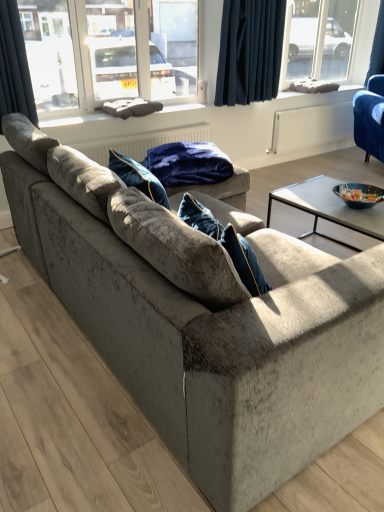
The image size is (384, 512). What do you see at coordinates (309, 86) in the screenshot? I see `blue fabric cushion at upper center, arranged as the 2th window sill when viewed from the left` at bounding box center [309, 86].

Locate an element on the screen. velvet blue armchair at upper right is located at coordinates (370, 118).

At what (x,y) coordinates should I click in order to perform the action: click on velvet blue blanket at center. Please return your answer as a coordinate pair (x, y). Looking at the image, I should click on (188, 164).

What do you see at coordinates (14, 66) in the screenshot? I see `dark blue velvet curtain at upper left, arranged as the 3th curtain when viewed from the back` at bounding box center [14, 66].

This screenshot has width=384, height=512. What do you see at coordinates (377, 47) in the screenshot?
I see `dark blue velvet curtain at upper right, marked as the third curtain in a left-to-right arrangement` at bounding box center [377, 47].

Find the location of `gray fabric cushion at center, which is the second window sill from top to bottom`. gray fabric cushion at center, which is the second window sill from top to bottom is located at coordinates (70, 120).

You are a GUI agent. You are given a task and a screenshot of the screen. Output one action in this format:
    pyautogui.click(x=<x>, y=<y>)
    Task: Click on the clear glass window frame at upper center
    This screenshot has width=384, height=512.
    Given the screenshot: What is the action you would take?
    pyautogui.click(x=81, y=51)

Does gray fabric cushion at center, arranged as the first window sill when ordered from the bottom, come in front of dark blue velvet curtain at upper right, marked as the third curtain in a left-to-right arrangement?

Yes, it is.

Is gray fabric cushion at center, the first window sill from the left, facing away from dark blue velvet curtain at upper right, which ranks as the first curtain in right-to-left order?

That's not correct — gray fabric cushion at center, the first window sill from the left, is not looking away from dark blue velvet curtain at upper right, which ranks as the first curtain in right-to-left order.

Looking at this image, from the image's perspective, which one is positioned lower, gray fabric cushion at center, positioned as the 2th window sill in right-to-left order, or dark blue velvet curtain at upper right, acting as the 3th curtain starting from the front?

gray fabric cushion at center, positioned as the 2th window sill in right-to-left order, is shown below in the image.

Does gray fabric cushion at center, marked as the 1th window sill in a front-to-back arrangement, have a lesser height compared to blue fabric cushion at upper center, arranged as the 2th window sill when viewed from the left?

Yes, gray fabric cushion at center, marked as the 1th window sill in a front-to-back arrangement, is shorter than blue fabric cushion at upper center, arranged as the 2th window sill when viewed from the left.

Is point (182, 104) behind point (299, 90)?

No, it is in front of (299, 90).

From a real-world perspective, which is physically below, gray fabric cushion at center, the 2th window sill viewed from the back, or blue fabric cushion at upper center, arranged as the 2th window sill when viewed from the left?

From a 3D spatial view, blue fabric cushion at upper center, arranged as the 2th window sill when viewed from the left, is below.

Would you say dark blue fabric at upper center, which appears as the second curtain when viewed from the back, is a long distance from gray fabric cushion at center, positioned as the 2th window sill in right-to-left order?

Yes, dark blue fabric at upper center, which appears as the second curtain when viewed from the back, and gray fabric cushion at center, positioned as the 2th window sill in right-to-left order, are quite far apart.

Considering the positions of objects dark blue fabric at upper center, acting as the 2th curtain starting from the right, and gray fabric cushion at center, the first window sill from the left, in the image provided, who is in front, dark blue fabric at upper center, acting as the 2th curtain starting from the right, or gray fabric cushion at center, the first window sill from the left,?

gray fabric cushion at center, the first window sill from the left.

Is dark blue fabric at upper center, acting as the 2th curtain starting from the right, positioned with its back to gray fabric cushion at center, positioned as the 2th window sill in right-to-left order?

dark blue fabric at upper center, acting as the 2th curtain starting from the right, is not turned away from gray fabric cushion at center, positioned as the 2th window sill in right-to-left order.

From the image's perspective, is velvet blue blanket at center below gray fabric cushion at center, the first window sill from the left?

Indeed, from the image's perspective, velvet blue blanket at center is shown beneath gray fabric cushion at center, the first window sill from the left.

Locate an element on the screen. The width and height of the screenshot is (384, 512). material to the right of gray fabric cushion at center, positioned as the 2th window sill in right-to-left order is located at coordinates (188, 164).

Are velvet blue blanket at center and gray fabric cushion at center, arranged as the first window sill when ordered from the bottom, making contact?

No, velvet blue blanket at center is not next to gray fabric cushion at center, arranged as the first window sill when ordered from the bottom.

Is velvet blue blanket at center aimed at gray fabric cushion at center, marked as the 1th window sill in a front-to-back arrangement?

No.

At what (x,y) coordinates should I click in order to perform the action: click on material in front of the clear glass window frame at upper center. Please return your answer as a coordinate pair (x, y). The height and width of the screenshot is (512, 384). Looking at the image, I should click on (188, 164).

Is clear glass window frame at upper center at the back of velvet blue blanket at center?

No, velvet blue blanket at center's orientation is not away from clear glass window frame at upper center.

Is velvet blue blanket at center taller or shorter than clear glass window frame at upper center?

In the image, velvet blue blanket at center appears to be shorter than clear glass window frame at upper center.

Is point (151, 164) less distant than point (65, 78)?

Yes, point (151, 164) is closer to viewer.

This screenshot has height=512, width=384. What are the coordinates of `curtain behind the blue fabric cushion at upper center, which is the first window sill from top to bottom` in the screenshot? It's located at (377, 47).

Is blue fabric cushion at upper center, which is the first window sill from top to bottom, closer to the viewer compared to dark blue velvet curtain at upper right, marked as the third curtain in a left-to-right arrangement?

Yes, blue fabric cushion at upper center, which is the first window sill from top to bottom, is in front of dark blue velvet curtain at upper right, marked as the third curtain in a left-to-right arrangement.

Is blue fabric cushion at upper center, the first window sill in the right-to-left sequence, outside of dark blue velvet curtain at upper right, marked as the third curtain in a left-to-right arrangement?

Yes, blue fabric cushion at upper center, the first window sill in the right-to-left sequence, is not within dark blue velvet curtain at upper right, marked as the third curtain in a left-to-right arrangement.

Does blue fabric cushion at upper center, which is the first window sill from top to bottom, have a lesser width compared to dark blue velvet curtain at upper right, marked as the third curtain in a left-to-right arrangement?

No.

How many degrees apart are the facing directions of gray fabric cushion at center, positioned as the 2th window sill in right-to-left order, and clear glass window frame at upper center?

0.0103 degrees.

Does gray fabric cushion at center, marked as the 1th window sill in a front-to-back arrangement, turn towards clear glass window frame at upper center?

No, gray fabric cushion at center, marked as the 1th window sill in a front-to-back arrangement, is not aimed at clear glass window frame at upper center.

Is gray fabric cushion at center, marked as the 1th window sill in a front-to-back arrangement, touching clear glass window frame at upper center?

No, gray fabric cushion at center, marked as the 1th window sill in a front-to-back arrangement, is not beside clear glass window frame at upper center.

Which window sill is the 1st one when counting from the back of the clear glass window frame at upper center? Please provide its 2D coordinates.

[(70, 120)]

In order to click on the 3rd curtain directly above the gray fabric cushion at center, the 2th window sill viewed from the back (from a real-world perspective) in this screenshot , I will do (377, 47).

Where is `window sill that is in front of the blue fabric cushion at upper center, which is the first window sill from top to bottom`? window sill that is in front of the blue fabric cushion at upper center, which is the first window sill from top to bottom is located at coordinates (70, 120).

When comparing their distances from clear glass window frame at upper center, does velvet blue blanket at center or velvet blue armchair at upper right seem further?

velvet blue armchair at upper right lies further to clear glass window frame at upper center than the other object.

Based on their spatial positions, is dark blue fabric at upper center, which appears as the second curtain when viewed from the back, or dark blue velvet curtain at upper right, acting as the 3th curtain starting from the front, further from velvet blue blanket at center?

The object further to velvet blue blanket at center is dark blue velvet curtain at upper right, acting as the 3th curtain starting from the front.

Consider the image. Which object lies further to the anchor point blue fabric cushion at upper center, the second window sill ordered from the bottom, clear glass window frame at upper center or velvet blue blanket at center?

Based on the image, velvet blue blanket at center appears to be further to blue fabric cushion at upper center, the second window sill ordered from the bottom.

Considering their positions, is dark blue velvet curtain at upper left, the third curtain positioned from the right, positioned closer to gray fabric cushion at center, positioned as the 2th window sill in right-to-left order, than dark blue fabric at upper center, which is the 2th curtain in left-to-right order?

dark blue velvet curtain at upper left, the third curtain positioned from the right, is closer to gray fabric cushion at center, positioned as the 2th window sill in right-to-left order.

Which object lies nearer to the anchor point velvet blue blanket at center, dark blue velvet curtain at upper left, the 1th curtain in the front-to-back sequence, or dark blue velvet curtain at upper right, marked as the third curtain in a left-to-right arrangement?

The object closer to velvet blue blanket at center is dark blue velvet curtain at upper left, the 1th curtain in the front-to-back sequence.

Which object lies nearer to the anchor point dark blue velvet curtain at upper left, arranged as the 3th curtain when viewed from the back, clear glass window frame at upper center or gray fabric cushion at center, the first window sill from the left?

gray fabric cushion at center, the first window sill from the left, lies closer to dark blue velvet curtain at upper left, arranged as the 3th curtain when viewed from the back, than the other object.

Estimate the real-world distances between objects in this image. Which object is closer to clear glass window frame at upper center, dark blue velvet curtain at upper left, the third curtain positioned from the right, or velvet blue armchair at upper right?

Among the two, dark blue velvet curtain at upper left, the third curtain positioned from the right, is located nearer to clear glass window frame at upper center.

Considering their positions, is clear glass window frame at upper center positioned closer to blue fabric cushion at upper center, arranged as the 2th window sill when viewed from the left, than dark blue velvet curtain at upper left, the 1th curtain in the front-to-back sequence?

clear glass window frame at upper center is closer to blue fabric cushion at upper center, arranged as the 2th window sill when viewed from the left.

Locate an element on the screen. material between dark blue velvet curtain at upper left, arranged as the 3th curtain when viewed from the back, and dark blue velvet curtain at upper right, acting as the 3th curtain starting from the front, from left to right is located at coordinates (188, 164).

At what (x,y) coordinates should I click in order to perform the action: click on studio couch between velvet blue blanket at center and dark blue velvet curtain at upper right, which ranks as the first curtain in right-to-left order. Please return your answer as a coordinate pair (x, y). The image size is (384, 512). Looking at the image, I should click on (370, 118).

At what (x,y) coordinates should I click in order to perform the action: click on window sill between velvet blue blanket at center and dark blue velvet curtain at upper right, acting as the 3th curtain starting from the front, in the horizontal direction. Please return your answer as a coordinate pair (x, y). The width and height of the screenshot is (384, 512). Looking at the image, I should click on (309, 86).

This screenshot has width=384, height=512. In order to click on curtain situated between clear glass window frame at upper center and velvet blue armchair at upper right from left to right in this screenshot , I will do `click(250, 51)`.